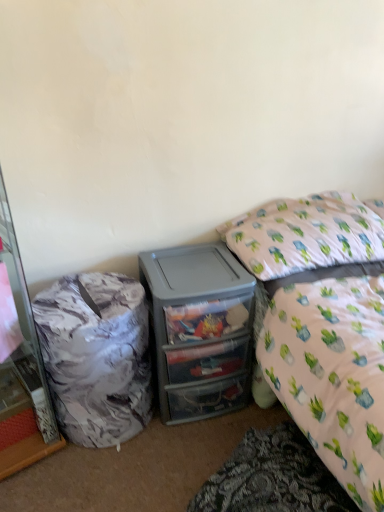
Question: Can you confirm if translucent plastic drawers at center is thinner than white fabric pillow at upper right?

Choices:
 (A) no
 (B) yes

Answer: (B)

Question: Is translucent plastic drawers at center further to camera compared to white fabric pillow at upper right?

Choices:
 (A) yes
 (B) no

Answer: (A)

Question: Does translucent plastic drawers at center have a larger size compared to white fabric pillow at upper right?

Choices:
 (A) yes
 (B) no

Answer: (A)

Question: Does translucent plastic drawers at center have a lesser height compared to white fabric pillow at upper right?

Choices:
 (A) no
 (B) yes

Answer: (A)

Question: From the image's perspective, would you say translucent plastic drawers at center is shown under white fabric pillow at upper right?

Choices:
 (A) no
 (B) yes

Answer: (B)

Question: From a real-world perspective, is white fabric pillow at upper right above or below marble-patterned cabinet at left?

Choices:
 (A) above
 (B) below

Answer: (A)

Question: Considering the positions of point (312, 209) and point (1, 461), is point (312, 209) closer or farther from the camera than point (1, 461)?

Choices:
 (A) farther
 (B) closer

Answer: (A)

Question: In terms of size, does white fabric pillow at upper right appear bigger or smaller than marble-patterned cabinet at left?

Choices:
 (A) big
 (B) small

Answer: (B)

Question: Is white fabric pillow at upper right in front of or behind marble-patterned cabinet at left in the image?

Choices:
 (A) behind
 (B) front

Answer: (A)

Question: From the image's perspective, is marble-patterned trash can at left located above or below marble-patterned cabinet at left?

Choices:
 (A) below
 (B) above

Answer: (A)

Question: In the image, is marble-patterned trash can at left on the left side or the right side of marble-patterned cabinet at left?

Choices:
 (A) left
 (B) right

Answer: (B)

Question: Choose the correct answer: Is marble-patterned trash can at left inside marble-patterned cabinet at left or outside it?

Choices:
 (A) inside
 (B) outside

Answer: (B)

Question: Is marble-patterned trash can at left wider or thinner than marble-patterned cabinet at left?

Choices:
 (A) thin
 (B) wide

Answer: (A)

Question: From the image's perspective, is translucent plastic drawers at center located above or below white fabric pillow at upper right?

Choices:
 (A) below
 (B) above

Answer: (A)

Question: Does point (185, 342) appear closer or farther from the camera than point (319, 220)?

Choices:
 (A) farther
 (B) closer

Answer: (B)